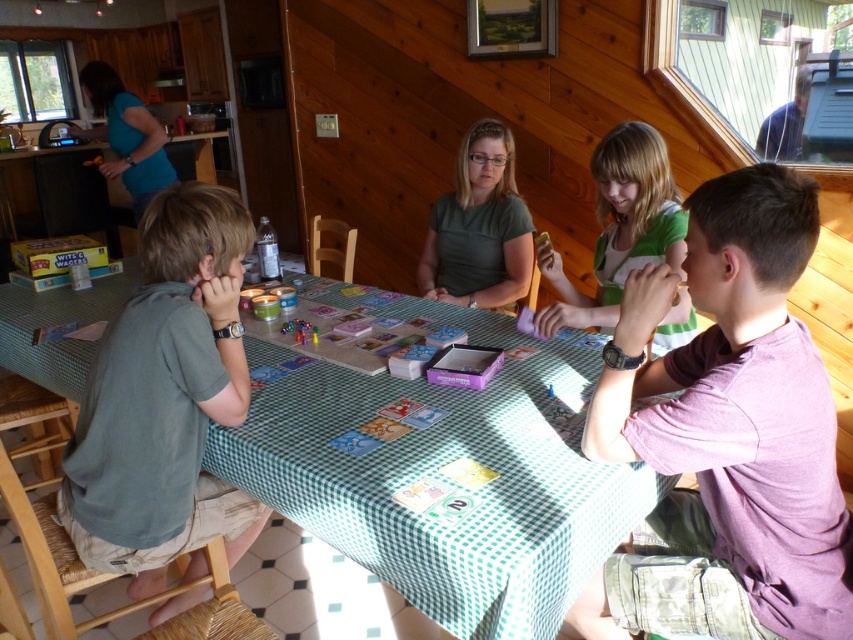
Question: Among these points, which one is farthest from the camera?

Choices:
 (A) (254, 396)
 (B) (108, 141)
 (C) (618, 128)
 (D) (512, 212)

Answer: (B)

Question: Is purple cotton shirt at upper right to the right of green cotton shirt at left from the viewer's perspective?

Choices:
 (A) no
 (B) yes

Answer: (B)

Question: Is green matte shirt at center above blue fabric shirt at upper left?

Choices:
 (A) no
 (B) yes

Answer: (A)

Question: In this image, where is purple cotton shirt at upper right located relative to blue fabric shirt at upper left?

Choices:
 (A) right
 (B) left

Answer: (A)

Question: Which object is positioned closest to the blue fabric shirt at upper left?

Choices:
 (A) green checkered tablecloth at center
 (B) purple cotton shirt at upper right
 (C) green cotton shirt at left
 (D) green jersey at center

Answer: (A)

Question: Which point appears closest to the camera in this image?

Choices:
 (A) (639, 148)
 (B) (456, 292)

Answer: (A)